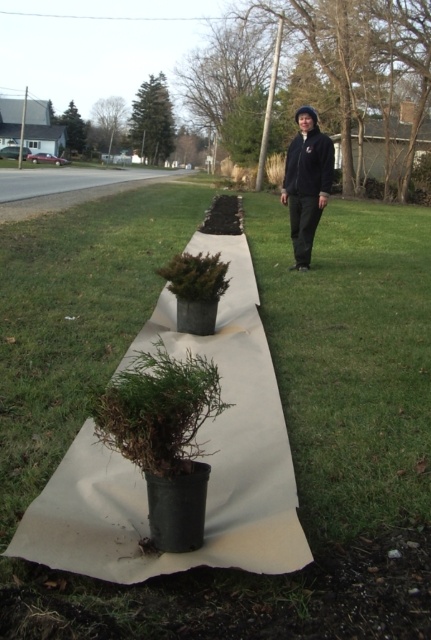
Question: Can you confirm if brown textured tree at upper center is positioned to the left of black fleece jacket at center?

Choices:
 (A) no
 (B) yes

Answer: (B)

Question: Among these objects, which one is farthest from the camera?

Choices:
 (A) brown textured tree at upper center
 (B) green matte tree at upper center

Answer: (B)

Question: Can you confirm if green textured evergreen tree at upper center is positioned to the right of green leafy tree at upper left?

Choices:
 (A) yes
 (B) no

Answer: (A)

Question: Which point is closer to the camera taking this photo?

Choices:
 (A) (149, 148)
 (B) (290, 166)
 (C) (99, 144)
 (D) (409, 120)

Answer: (B)

Question: Which point appears farthest from the camera in this image?

Choices:
 (A) (302, 230)
 (B) (158, 128)
 (C) (99, 120)

Answer: (C)

Question: Is brown textured tree at upper center to the left of green matte tree at upper center from the viewer's perspective?

Choices:
 (A) no
 (B) yes

Answer: (A)